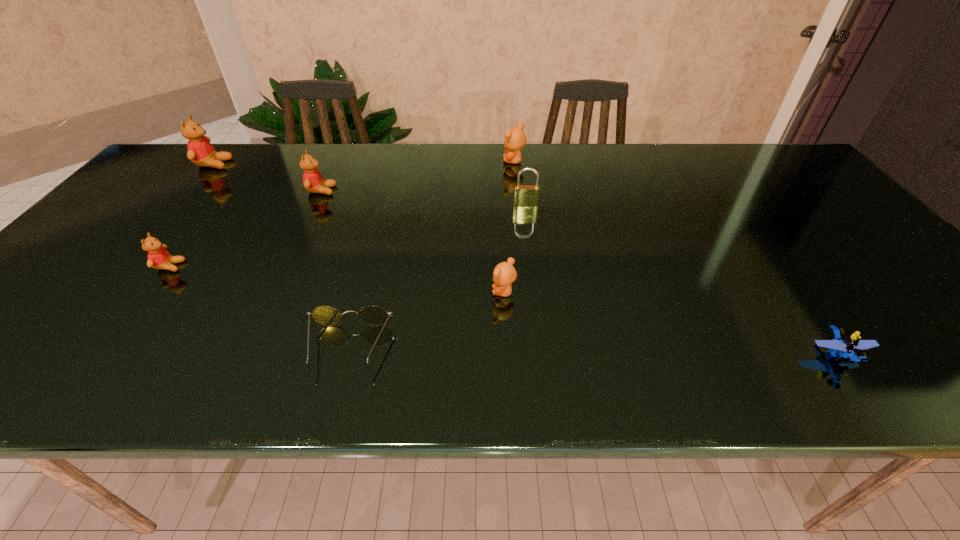
Locate an element on the screen. This screenshot has height=540, width=960. vacant region at the near edge of the desktop is located at coordinates (201, 391).

This screenshot has height=540, width=960. I want to click on free spot at the left edge of the desktop, so click(181, 199).

Find the location of a particular element. This screenshot has height=540, width=960. free space at the right edge is located at coordinates (876, 254).

The width and height of the screenshot is (960, 540). I want to click on free space between the farthest red teddy bear and the farther brown teddy bear, so click(364, 163).

You are a GUI agent. You are given a task and a screenshot of the screen. Output one action in this format:
    pyautogui.click(x=<x>, y=<y>)
    Task: Click on the vacant space in between the farther brown teddy bear and the nearest red teddy bear
    
    Given the screenshot: What is the action you would take?
    pyautogui.click(x=342, y=214)

Where is `blank region between the fourth object from left to right and the second object from left to right`? The width and height of the screenshot is (960, 540). blank region between the fourth object from left to right and the second object from left to right is located at coordinates (259, 307).

Where is `vacant area that lies between the padlock and the second smallest red teddy bear`? This screenshot has height=540, width=960. vacant area that lies between the padlock and the second smallest red teddy bear is located at coordinates (423, 198).

I want to click on unoccupied position between the brass padlock and the nearer brown teddy bear, so click(515, 248).

This screenshot has width=960, height=540. What are the coordinates of `empty space that is in between the farthest red teddy bear and the fourth object from left to right` in the screenshot? It's located at (281, 255).

Where is `free space between the seventh object from right to left and the leftmost teddy bear`? This screenshot has width=960, height=540. free space between the seventh object from right to left and the leftmost teddy bear is located at coordinates (192, 215).